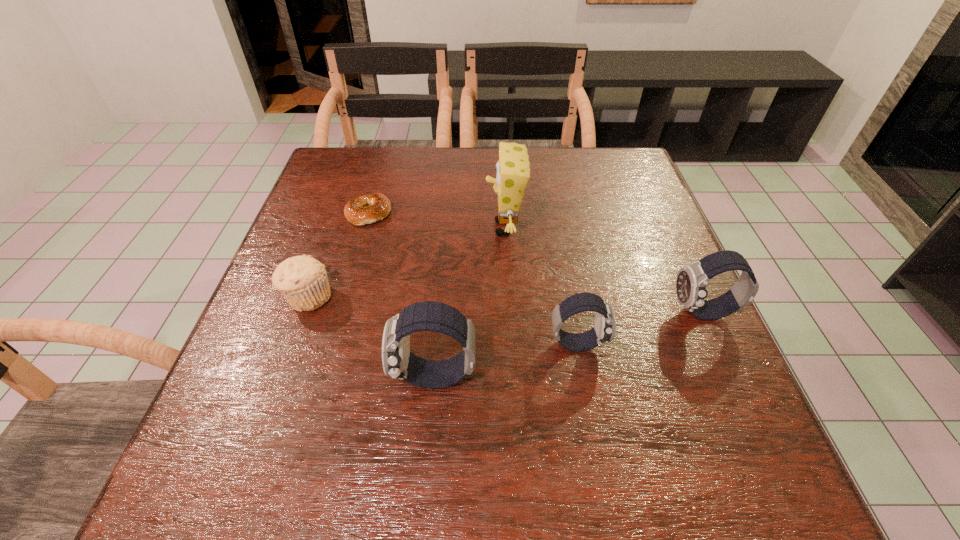
Identify the location of empty location between the shortest object and the rightmost watch. (536, 262).

Locate an element on the screen. the closest object to the leftmost watch is located at coordinates coord(604,329).

Where is `object that is the nearest to the muffin`? The width and height of the screenshot is (960, 540). object that is the nearest to the muffin is located at coordinates (366, 209).

Locate which watch is the second closest to the fifth object from left to right. Please provide its 2D coordinates. Your answer should be formatted as a tuple, i.e. [(x, y)], where the tuple contains the x and y coordinates of a point satisfying the conditions above.

[(691, 284)]

Identify which watch is located as the second nearest to the sponge. Please provide its 2D coordinates. Your answer should be formatted as a tuple, i.e. [(x, y)], where the tuple contains the x and y coordinates of a point satisfying the conditions above.

[(398, 362)]

This screenshot has width=960, height=540. What are the coordinates of `free space that satisfies the following two spatial constraints: 1. on the face of the sponge; 2. on the front side of the fifth tallest object` in the screenshot? It's located at [x=508, y=297].